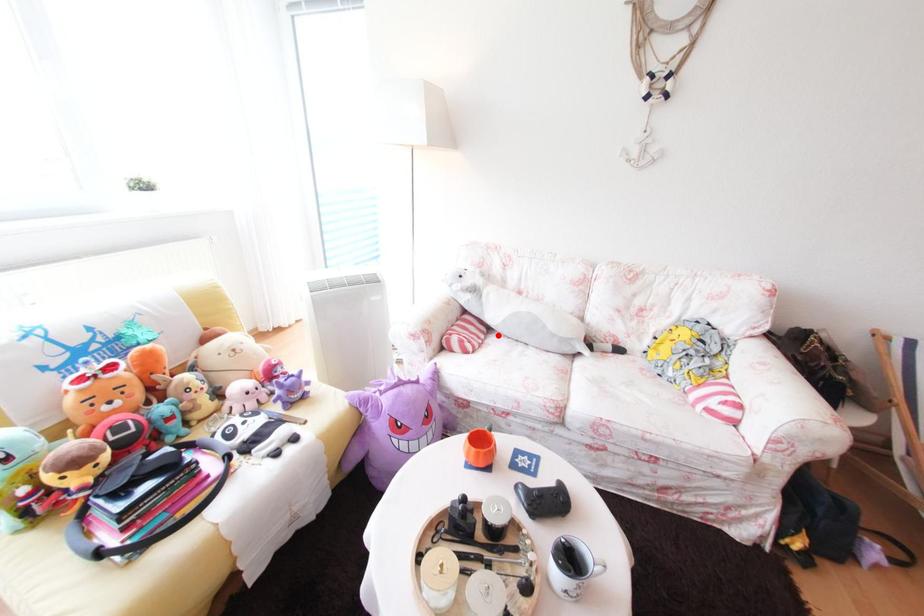
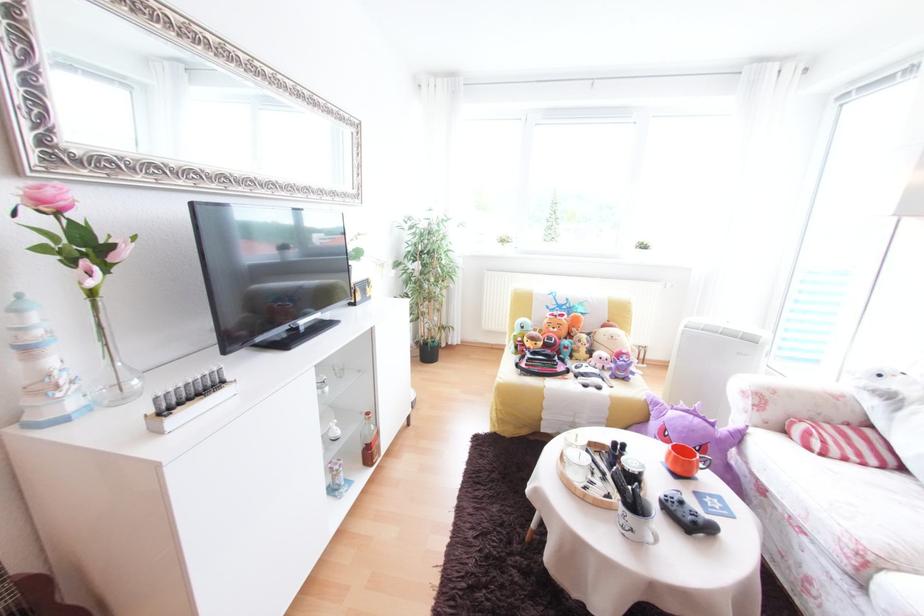
Question: I am providing you with two images of the same scene from different viewpoints. A red point is marked on the first image. Is the red point's position out of view in image 2?

Choices:
 (A) Yes
 (B) No

Answer: (B)